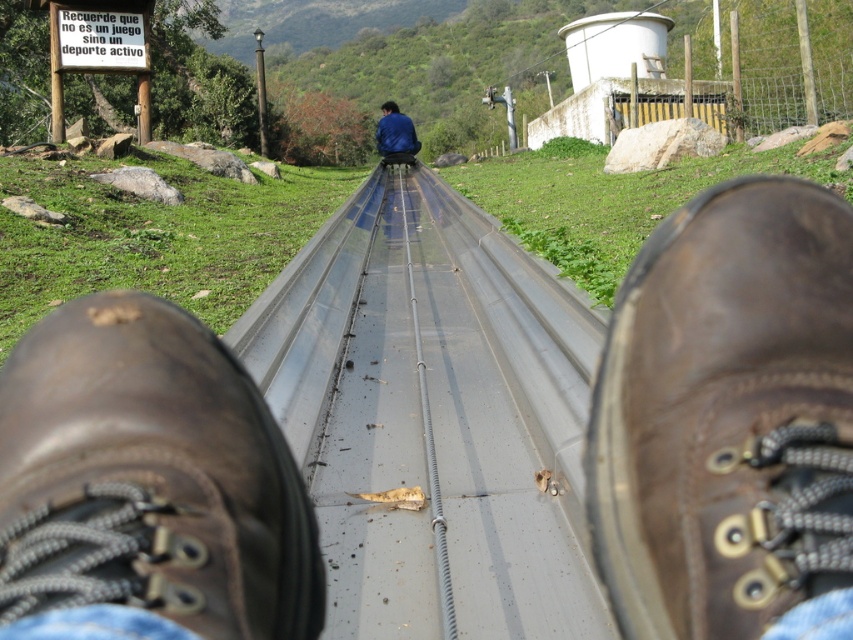
You are standing at the top of the slide and want to slide down to the metallic smooth train track at center. There is a blue fabric jacket at center in your way. Which object should you avoid hitting as you slide down?

You should avoid hitting the blue fabric jacket at center because it is smaller than the metallic smooth train track at center and might be in your path.